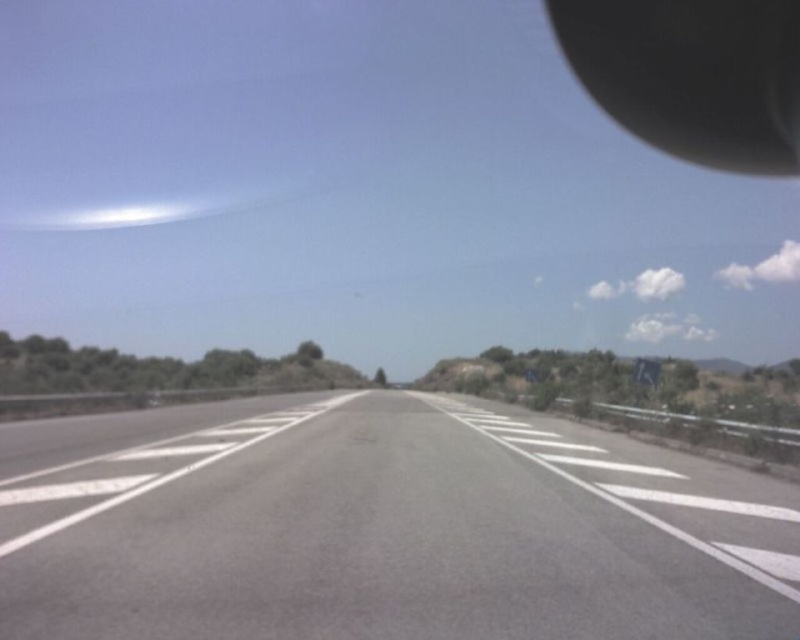
Question: Does gray asphalt highway at center come in front of black rubber rearview mirror at upper right?

Choices:
 (A) yes
 (B) no

Answer: (A)

Question: Can you confirm if gray asphalt highway at center is wider than black rubber rearview mirror at upper right?

Choices:
 (A) yes
 (B) no

Answer: (B)

Question: Does gray asphalt highway at center come in front of black rubber rearview mirror at upper right?

Choices:
 (A) yes
 (B) no

Answer: (A)

Question: Which point appears closest to the camera in this image?

Choices:
 (A) (716, 632)
 (B) (716, 45)

Answer: (A)

Question: Which object appears closest to the camera in this image?

Choices:
 (A) gray asphalt highway at center
 (B) black rubber rearview mirror at upper right

Answer: (A)